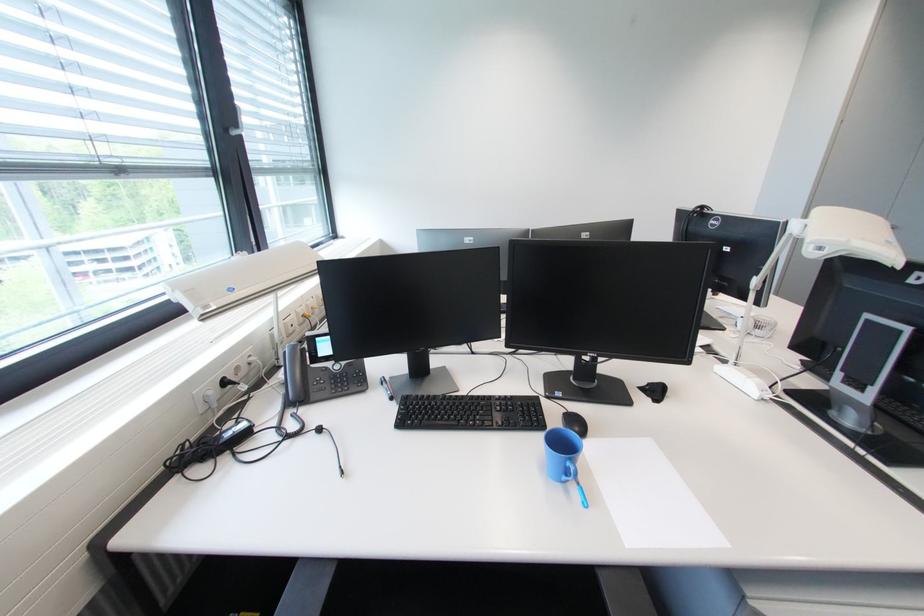
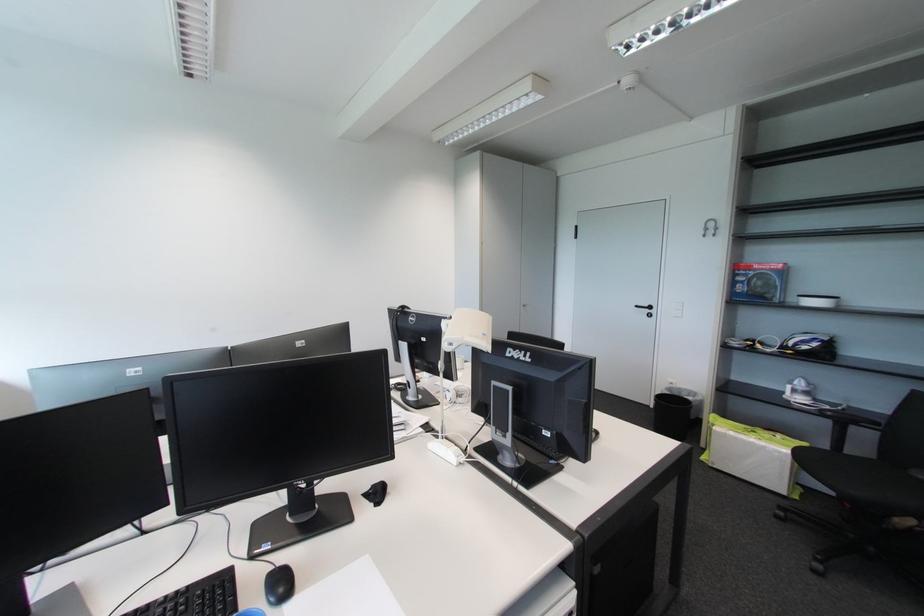
Question: The camera is either moving clockwise (left) or counter-clockwise (right) around the object. The first image is from the beginning of the video and the second image is from the end. Is the camera moving left or right when shooting the video?

Choices:
 (A) Left
 (B) Right

Answer: (A)